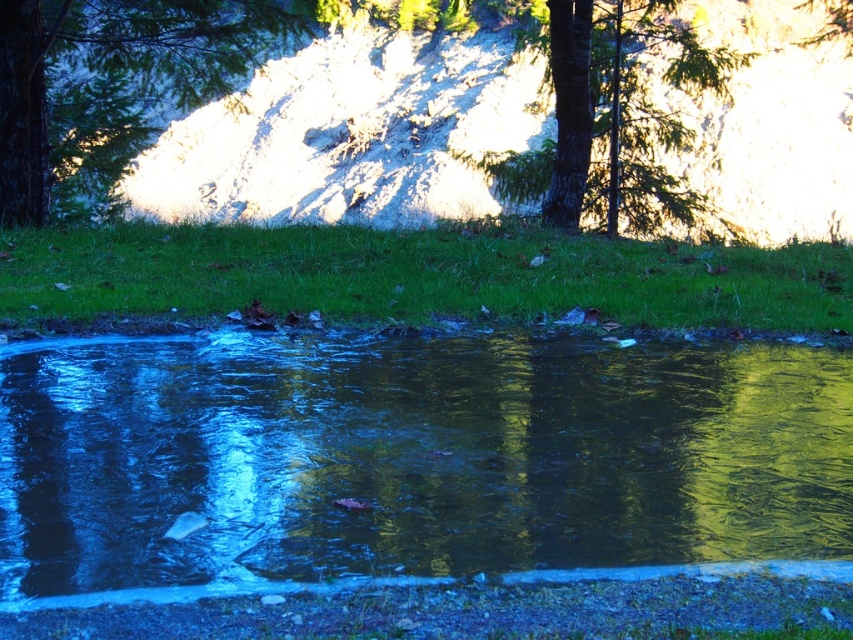
Question: Among these objects, which one is farthest from the camera?

Choices:
 (A) green textured tree at center
 (B) clear liquid water at center
 (C) green textured tree at upper left

Answer: (A)

Question: Can you confirm if clear liquid water at center is wider than green textured tree at upper left?

Choices:
 (A) yes
 (B) no

Answer: (B)

Question: Which point is farther to the camera?

Choices:
 (A) (3, 573)
 (B) (563, 134)

Answer: (B)

Question: Does clear liquid water at center have a larger size compared to green textured tree at center?

Choices:
 (A) yes
 (B) no

Answer: (B)

Question: Does green textured tree at upper left appear under green textured tree at center?

Choices:
 (A) yes
 (B) no

Answer: (A)

Question: Which point appears closest to the camera in this image?

Choices:
 (A) (247, 16)
 (B) (589, 54)
 (C) (125, 541)

Answer: (C)